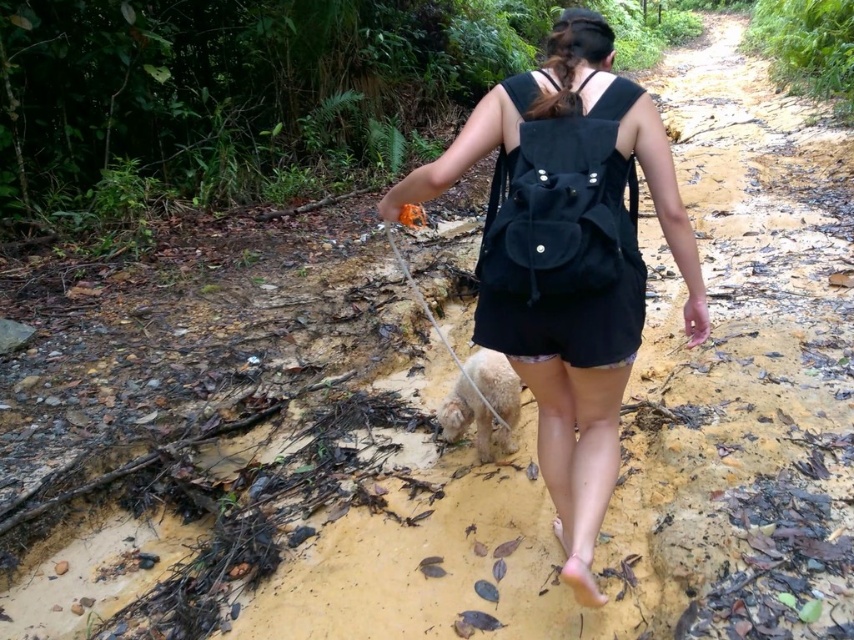
Is black suede backpack at center thinner than smooth nylon leash at lower center?

Yes, black suede backpack at center is thinner than smooth nylon leash at lower center.

Does point (537, 253) come closer to viewer compared to point (509, 426)?

That is True.

Is point (519, 289) positioned behind point (390, 236)?

No, (519, 289) is in front of (390, 236).

The image size is (854, 640). What are the coordinates of `black suede backpack at center` in the screenshot? It's located at (560, 202).

Can you confirm if black fabric backpack at center is positioned to the right of black suede backpack at center?

No, black fabric backpack at center is not to the right of black suede backpack at center.

Which of these two, black fabric backpack at center or black suede backpack at center, stands shorter?

black suede backpack at center

The height and width of the screenshot is (640, 854). What do you see at coordinates (574, 394) in the screenshot?
I see `black fabric backpack at center` at bounding box center [574, 394].

This screenshot has height=640, width=854. Identify the location of black fabric backpack at center. (574, 394).

Does black fabric backpack at center lie behind smooth nylon leash at lower center?

No.

Does black fabric backpack at center have a lesser height compared to smooth nylon leash at lower center?

In fact, black fabric backpack at center may be taller than smooth nylon leash at lower center.

Image resolution: width=854 pixels, height=640 pixels. I want to click on black fabric backpack at center, so click(x=574, y=394).